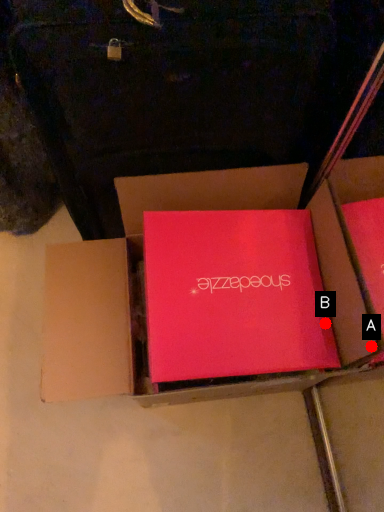
Question: Two points are circled on the image, labeled by A and B beside each circle. Which point is farther to the camera?

Choices:
 (A) A is further
 (B) B is further

Answer: (B)